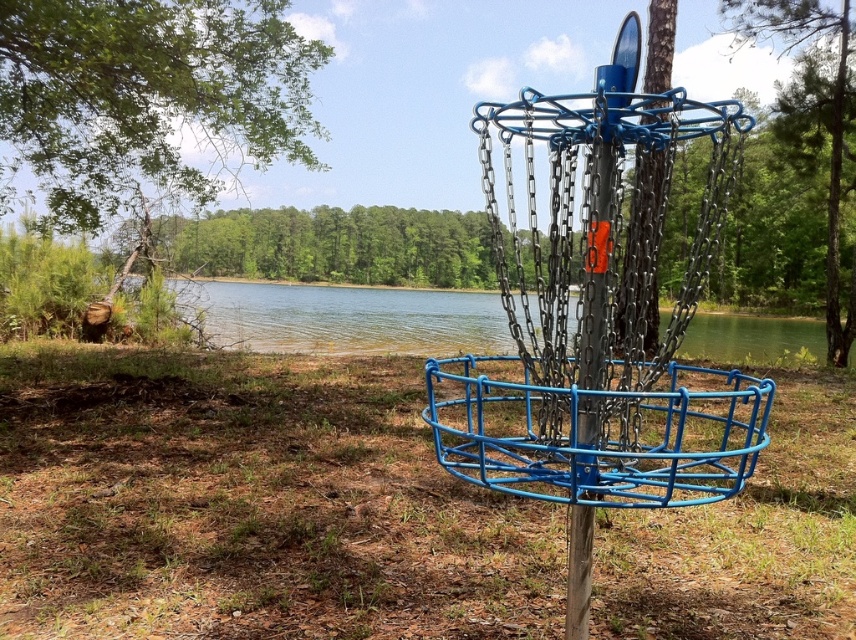
Question: Does blue metallic basket at center appear on the left side of clear water at center?

Choices:
 (A) no
 (B) yes

Answer: (B)

Question: Which point is farther from the camera taking this photo?

Choices:
 (A) 728,1
 (B) 250,88
 (C) 593,413
 (D) 277,218

Answer: (D)

Question: Which of the following is the closest to the observer?

Choices:
 (A) (197, 138)
 (B) (266, 228)
 (C) (723, 486)
 (D) (837, 54)

Answer: (C)

Question: Is clear water at center above green leafy tree at center?

Choices:
 (A) yes
 (B) no

Answer: (B)

Question: Considering the relative positions of blue metallic basket at center and green leafy tree at center in the image provided, where is blue metallic basket at center located with respect to green leafy tree at center?

Choices:
 (A) left
 (B) right

Answer: (B)

Question: Considering the real-world distances, which object is closest to the green leafy tree at center?

Choices:
 (A) clear water at center
 (B) green leafy tree at upper left

Answer: (A)